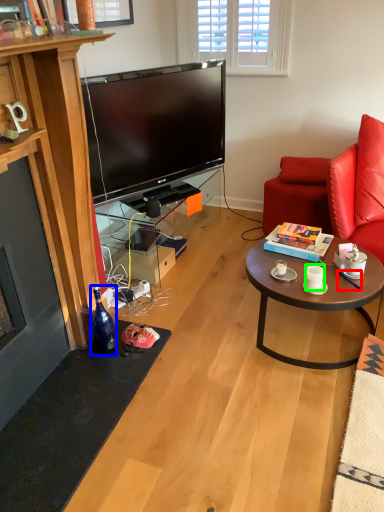
Question: Based on their relative distances, which object is farther from pen (highlighted by a red box)? Choose from bottle (highlighted by a blue box) and coffee cup (highlighted by a green box).

Choices:
 (A) bottle
 (B) coffee cup

Answer: (A)